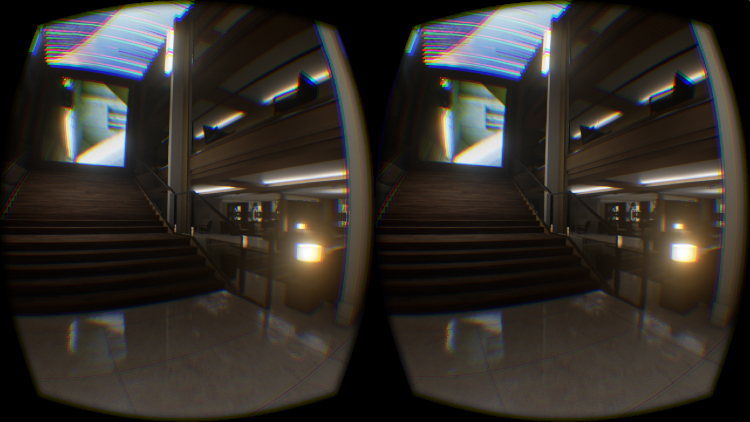
You are a GUI agent. You are given a task and a screenshot of the screen. Output one action in this format:
    pyautogui.click(x=<x>, y=<y>)
    Task: Click on the yellow light
    Image resolution: width=750 pixels, height=422 pixels.
    Given the screenshot: What is the action you would take?
    pyautogui.click(x=679, y=258)